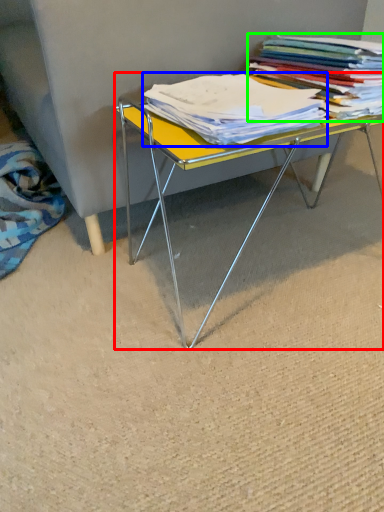
Question: Based on their relative distances, which object is farther from table (highlighted by a red box)? Choose from magazine (highlighted by a blue box) and book (highlighted by a green box).

Choices:
 (A) magazine
 (B) book

Answer: (B)